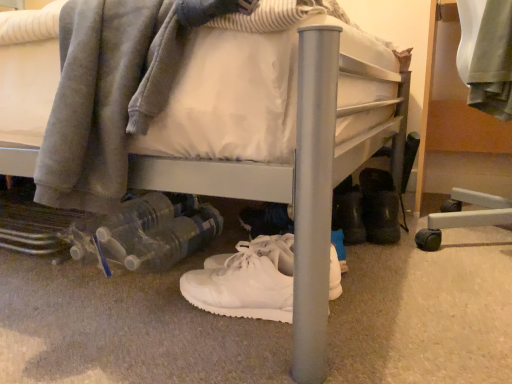
Question: From a real-world perspective, is black rubber boots at lower right, the first footwear from the back, positioned over white leather sneakers at center, the second footwear from the back, based on gravity?

Choices:
 (A) yes
 (B) no

Answer: (A)

Question: Is black rubber boots at lower right, the second footwear positioned from the left, located outside white leather sneakers at center, positioned as the first footwear in left-to-right order?

Choices:
 (A) yes
 (B) no

Answer: (A)

Question: Would you say black rubber boots at lower right, positioned as the 2th footwear in front-to-back order, contains white leather sneakers at center, which ranks as the 1th footwear in front-to-back order?

Choices:
 (A) yes
 (B) no

Answer: (B)

Question: Does black rubber boots at lower right, the second footwear positioned from the left, come in front of white leather sneakers at center, positioned as the first footwear in left-to-right order?

Choices:
 (A) yes
 (B) no

Answer: (B)

Question: Does black rubber boots at lower right, the 1th footwear from the right, have a larger size compared to white leather sneakers at center, positioned as the first footwear in left-to-right order?

Choices:
 (A) yes
 (B) no

Answer: (A)

Question: Considering the relative sizes of black rubber boots at lower right, the 1th footwear from the right, and white leather sneakers at center, the first footwear in the bottom-to-top sequence, in the image provided, is black rubber boots at lower right, the 1th footwear from the right, wider than white leather sneakers at center, the first footwear in the bottom-to-top sequence,?

Choices:
 (A) yes
 (B) no

Answer: (A)

Question: Are white leather sneakers at center, the 2th footwear when ordered from right to left, and brushed metal bed frame at right located far from each other?

Choices:
 (A) yes
 (B) no

Answer: (B)

Question: From a real-world perspective, does white leather sneakers at center, positioned as the first footwear in left-to-right order, sit lower than brushed metal bed frame at right?

Choices:
 (A) yes
 (B) no

Answer: (A)

Question: From the image's perspective, would you say white leather sneakers at center, the first footwear in the bottom-to-top sequence, is shown under brushed metal bed frame at right?

Choices:
 (A) yes
 (B) no

Answer: (A)

Question: Is white leather sneakers at center, positioned as the first footwear in left-to-right order, next to brushed metal bed frame at right?

Choices:
 (A) yes
 (B) no

Answer: (B)

Question: Is white leather sneakers at center, the second footwear from the back, further to camera compared to brushed metal bed frame at right?

Choices:
 (A) no
 (B) yes

Answer: (A)

Question: Is white leather sneakers at center, the 2th footwear when ordered from right to left, aimed at brushed metal bed frame at right?

Choices:
 (A) yes
 (B) no

Answer: (B)

Question: From the image's perspective, would you say brushed metal bed frame at right is shown under white leather sneakers at center, the 2th footwear when ordered from right to left?

Choices:
 (A) no
 (B) yes

Answer: (A)